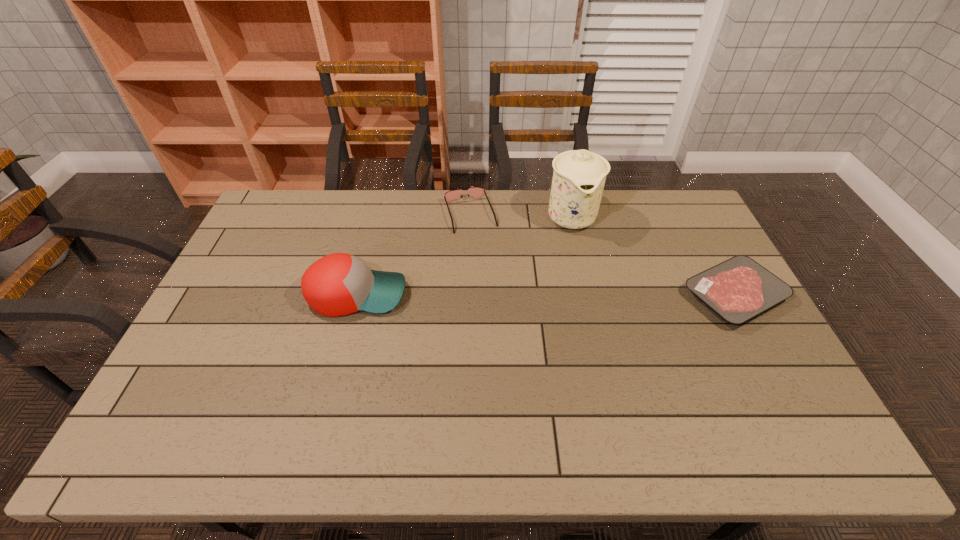
Identify the location of vacant space on the desktop that is between the third shortest object and the rightmost object and is positioned on the bridge of the sunglasses. (500, 294).

The height and width of the screenshot is (540, 960). Identify the location of free space on the desktop that is between the third shortest object and the shortest object and is positioned on the spout of the tallest object. (596, 295).